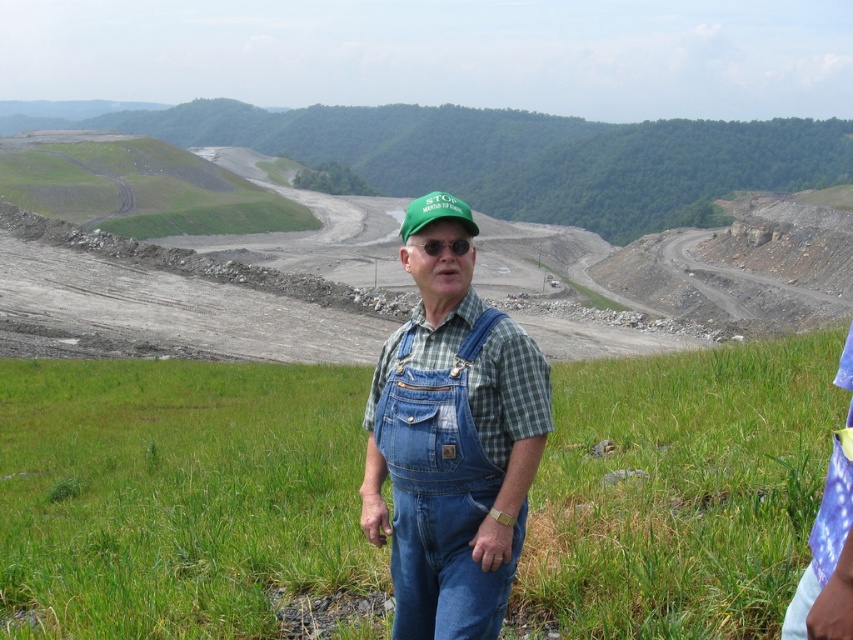
Question: Does green grass at center appear on the left side of denim overalls at center?

Choices:
 (A) no
 (B) yes

Answer: (B)

Question: Which point is farther to the camera?

Choices:
 (A) green grass at center
 (B) black plastic goggles at center
 (C) denim overalls at center

Answer: (A)

Question: In this image, where is green grassy hillside at upper center located relative to black plastic goggles at center?

Choices:
 (A) above
 (B) below

Answer: (A)

Question: Which of these objects is positioned farthest from the green fabric cap at center?

Choices:
 (A) green grassy hillside at upper center
 (B) black plastic goggles at center
 (C) denim overalls at center

Answer: (A)

Question: Can you confirm if denim overalls at center is positioned below black plastic goggles at center?

Choices:
 (A) yes
 (B) no

Answer: (A)

Question: Considering the real-world distances, which object is farthest from the green grass at center?

Choices:
 (A) black plastic goggles at center
 (B) green grassy hillside at upper center
 (C) denim overalls at center

Answer: (B)